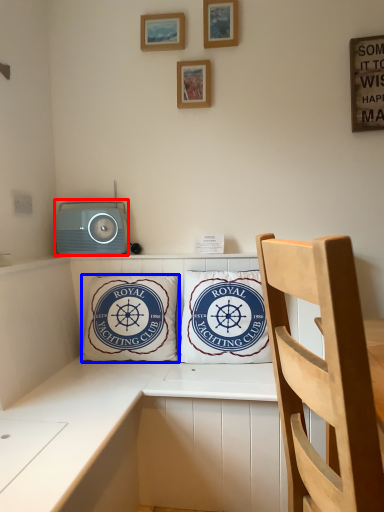
Question: Which object is closer to the camera taking this photo, stereo (highlighted by a red box) or pillow (highlighted by a blue box)?

Choices:
 (A) stereo
 (B) pillow

Answer: (B)